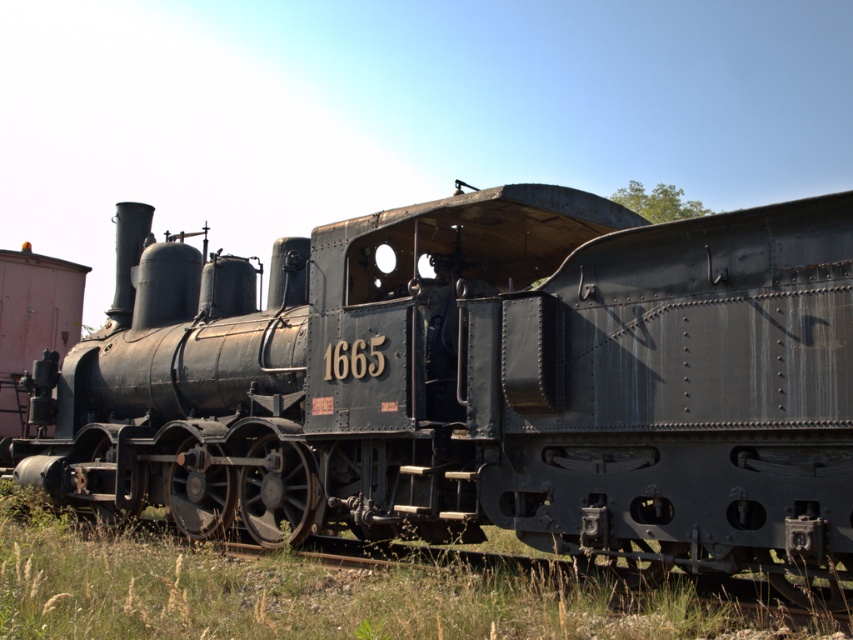
Is matte black locomotive at center below green grass at lower left?

Actually, matte black locomotive at center is above green grass at lower left.

Who is positioned more to the left, matte black locomotive at center or green grass at lower left?

Positioned to the left is matte black locomotive at center.

Who is more forward, (590, 512) or (647, 618)?

Point (647, 618) is more forward.

Where is `matte black locomotive at center`? This screenshot has height=640, width=853. matte black locomotive at center is located at coordinates (480, 385).